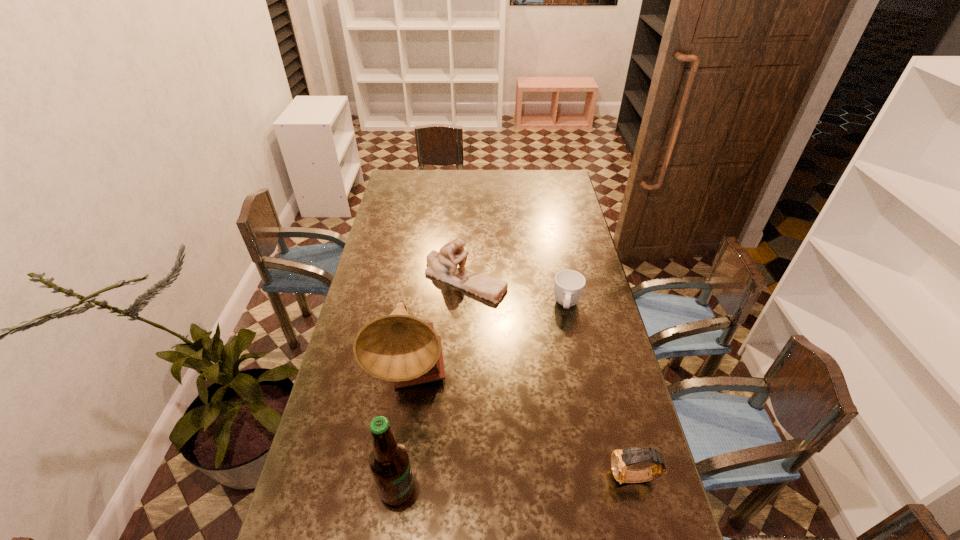
You are a GUI agent. You are given a task and a screenshot of the screen. Output one action in this format:
    pyautogui.click(x=<x>, y=<y>)
    Task: Click on the vacant point located between the fourth shortest object and the cup
    This screenshot has width=960, height=540.
    Given the screenshot: What is the action you would take?
    pyautogui.click(x=482, y=397)

I want to click on empty space between the cup and the beer bottle, so click(482, 397).

At what (x,y) coordinates should I click in order to perform the action: click on empty location between the fourth shortest object and the figurine. Please return your answer as a coordinate pair (x, y). The width and height of the screenshot is (960, 540). Looking at the image, I should click on (431, 384).

The height and width of the screenshot is (540, 960). I want to click on vacant space that's between the phonograph record and the watch, so click(x=523, y=427).

At what (x,y) coordinates should I click in order to perform the action: click on free space between the figurine and the watch. Please return your answer as a coordinate pair (x, y). This screenshot has width=960, height=540. Looking at the image, I should click on pos(550,379).

You are a GUI agent. You are given a task and a screenshot of the screen. Output one action in this format:
    pyautogui.click(x=<x>, y=<y>)
    Task: Click on the free space that is in between the third farthest object and the third shortest object
    
    Given the screenshot: What is the action you would take?
    pyautogui.click(x=439, y=328)

Identify the location of vacant area that lies between the phonograph record and the cup. The width and height of the screenshot is (960, 540). (490, 341).

Select which object appears as the second closest to the tallest object. Please provide its 2D coordinates. Your answer should be formatted as a tuple, i.e. [(x, y)], where the tuple contains the x and y coordinates of a point satisfying the conditions above.

[(442, 265)]

Identify which object is located as the second nearest to the beer bottle. Please provide its 2D coordinates. Your answer should be formatted as a tuple, i.e. [(x, y)], where the tuple contains the x and y coordinates of a point satisfying the conditions above.

[(620, 459)]